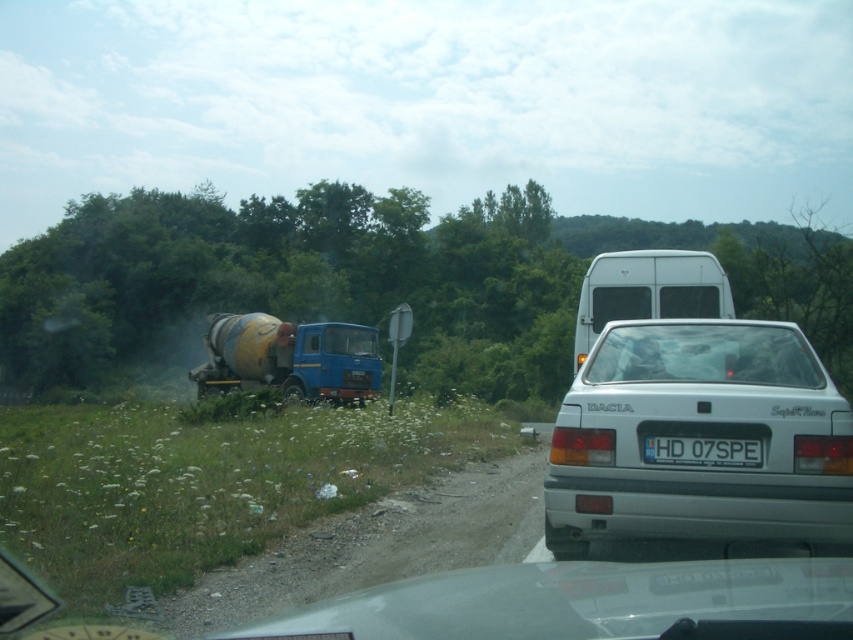
Is silver metallic car at center positioned behind white plastic license plate at center?

No, it is not.

Identify the location of silver metallic car at center. (590, 604).

Who is more distant from viewer, (430, 579) or (671, 444)?

Positioned behind is point (430, 579).

Where is `silver metallic car at center`? The width and height of the screenshot is (853, 640). silver metallic car at center is located at coordinates (590, 604).

Is white matte hatchback at center further to camera compared to white matte van at upper center?

That is False.

Measure the distance from white matte hatchback at center to white matte van at upper center.

white matte hatchback at center and white matte van at upper center are 7.24 meters apart from each other.

Describe the element at coordinates (699, 438) in the screenshot. I see `white matte hatchback at center` at that location.

Identify the location of white matte hatchback at center. (699, 438).

Can you confirm if white matte hatchback at center is positioned above dirt gravel at lower left?

Yes, white matte hatchback at center is above dirt gravel at lower left.

Does point (787, 360) come behind point (181, 627)?

Yes, point (787, 360) is farther from viewer.

In order to click on white matte hatchback at center in this screenshot , I will do `click(699, 438)`.